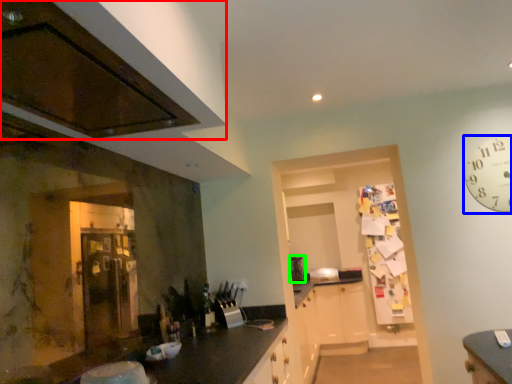
Question: Which is nearer to the cabinetry (highlighted by a red box)? clock (highlighted by a blue box) or appliance (highlighted by a green box).

Choices:
 (A) clock
 (B) appliance

Answer: (A)